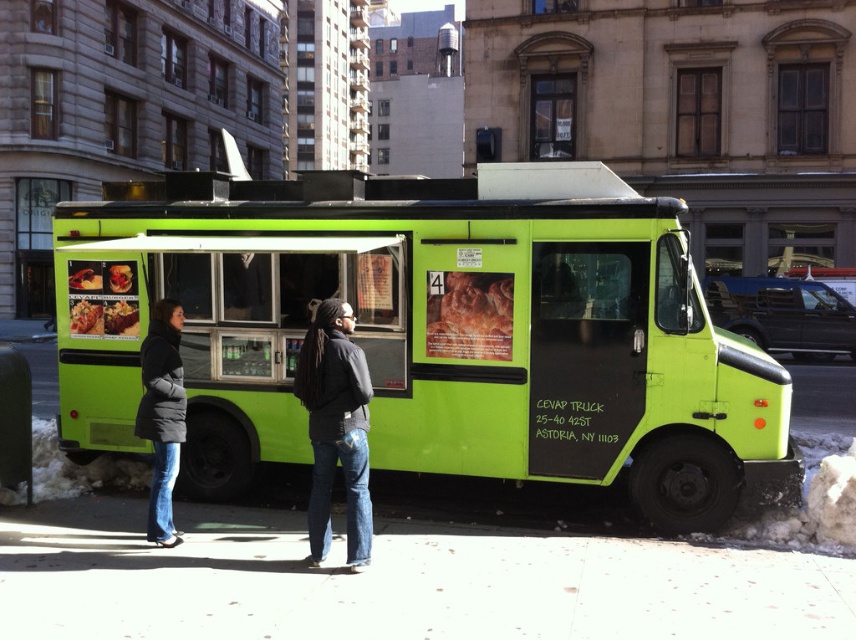
You are a delivery person with a 1.5 meter wide cart. You need to pass through the space between the smooth concrete sidewalk at center and the matte green food truck at center. Can your cart fit through the space?

The smooth concrete sidewalk at center is wider than the matte green food truck at center, so the space between them is at least as wide as the truck. Since your cart is 1.5 meters wide, it should fit through the space if the truck is positioned such that the remaining space on the sidewalk is sufficient. However, without exact measurements, it is recommended to check the actual width before proceeding.

What is located at the point with coordinates (x=397, y=580) in the image?

The smooth concrete sidewalk at center is located at point (x=397, y=580).